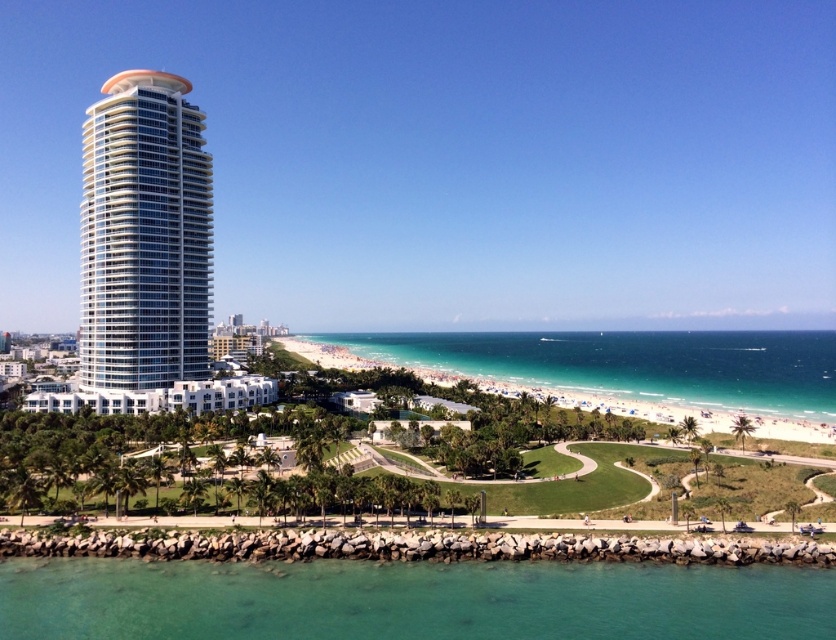
Question: Is white glass tower at left wider than clear blue water at center?

Choices:
 (A) no
 (B) yes

Answer: (A)

Question: Does clear glass water at lower center appear over white glass tower at left?

Choices:
 (A) yes
 (B) no

Answer: (B)

Question: Which object is the farthest from the white glass tower at left?

Choices:
 (A) clear blue water at center
 (B) clear glass water at lower center

Answer: (A)

Question: Considering the real-world distances, which object is closest to the clear glass water at lower center?

Choices:
 (A) white glass tower at left
 (B) clear blue water at center

Answer: (A)

Question: Is clear glass water at lower center to the right of clear blue water at center from the viewer's perspective?

Choices:
 (A) no
 (B) yes

Answer: (A)

Question: Which is nearer to the clear blue water at center?

Choices:
 (A) white glass tower at left
 (B) clear glass water at lower center

Answer: (A)